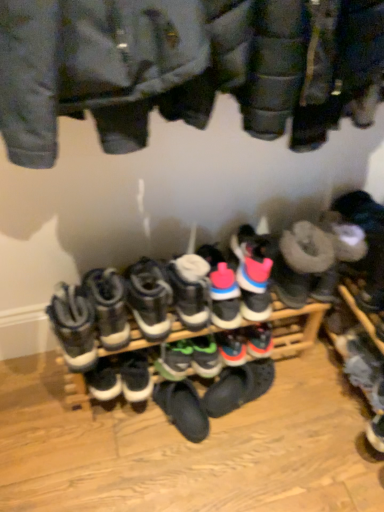
Question: Is green suede sneakers at center, the fifth footwear positioned from the right, bigger than pink suede sneakers at center, which ranks as the 3th footwear in right-to-left order?

Choices:
 (A) yes
 (B) no

Answer: (B)

Question: Is green suede sneakers at center, the fifth footwear positioned from the right, closer to the viewer compared to pink suede sneakers at center, which ranks as the 3th footwear in right-to-left order?

Choices:
 (A) no
 (B) yes

Answer: (A)

Question: From a real-world perspective, is green suede sneakers at center, the fifth footwear positioned from the right, positioned under pink suede sneakers at center, the seventh footwear positioned from the left, based on gravity?

Choices:
 (A) no
 (B) yes

Answer: (B)

Question: Can you confirm if green suede sneakers at center, which is the 5th footwear in left-to-right order, is positioned to the left of pink suede sneakers at center, the seventh footwear positioned from the left?

Choices:
 (A) yes
 (B) no

Answer: (A)

Question: Is green suede sneakers at center, which is the 5th footwear in left-to-right order, positioned far away from pink suede sneakers at center, the seventh footwear positioned from the left?

Choices:
 (A) yes
 (B) no

Answer: (B)

Question: From their relative heights in the image, would you say green suede sneakers at center, which is the 5th footwear in left-to-right order, is taller or shorter than white suede sneakers at center, placed as the sixth footwear when sorted from left to right?

Choices:
 (A) tall
 (B) short

Answer: (B)

Question: From a real-world perspective, is green suede sneakers at center, which is the 5th footwear in left-to-right order, above or below white suede sneakers at center, placed as the sixth footwear when sorted from left to right?

Choices:
 (A) below
 (B) above

Answer: (A)

Question: From the image's perspective, is green suede sneakers at center, the fifth footwear positioned from the right, positioned above or below white suede sneakers at center, acting as the fourth footwear starting from the right?

Choices:
 (A) below
 (B) above

Answer: (A)

Question: Considering the positions of point (185, 348) and point (187, 275), is point (185, 348) closer or farther from the camera than point (187, 275)?

Choices:
 (A) farther
 (B) closer

Answer: (A)

Question: Is point (107, 293) closer or farther from the camera than point (203, 245)?

Choices:
 (A) farther
 (B) closer

Answer: (B)

Question: Visually, is white leather sneakers at center, which appears as the 2th footwear when viewed from the left, positioned to the left or to the right of pink suede sneakers at center, which ranks as the 3th footwear in right-to-left order?

Choices:
 (A) left
 (B) right

Answer: (A)

Question: In terms of height, does white leather sneakers at center, which appears as the 2th footwear when viewed from the left, look taller or shorter compared to pink suede sneakers at center, which ranks as the 3th footwear in right-to-left order?

Choices:
 (A) short
 (B) tall

Answer: (B)

Question: In terms of size, does white leather sneakers at center, which is the eighth footwear in right-to-left order, appear bigger or smaller than pink suede sneakers at center, the seventh footwear positioned from the left?

Choices:
 (A) small
 (B) big

Answer: (B)

Question: Considering the positions of white suede sneakers at center, acting as the fourth footwear starting from the right, and black suede sneaker at center, the seventh footwear when ordered from right to left, in the image, is white suede sneakers at center, acting as the fourth footwear starting from the right, wider or thinner than black suede sneaker at center, the seventh footwear when ordered from right to left,?

Choices:
 (A) thin
 (B) wide

Answer: (B)

Question: From the image's perspective, is white suede sneakers at center, placed as the sixth footwear when sorted from left to right, above or below black suede sneaker at center, marked as the third footwear in a left-to-right arrangement?

Choices:
 (A) below
 (B) above

Answer: (B)